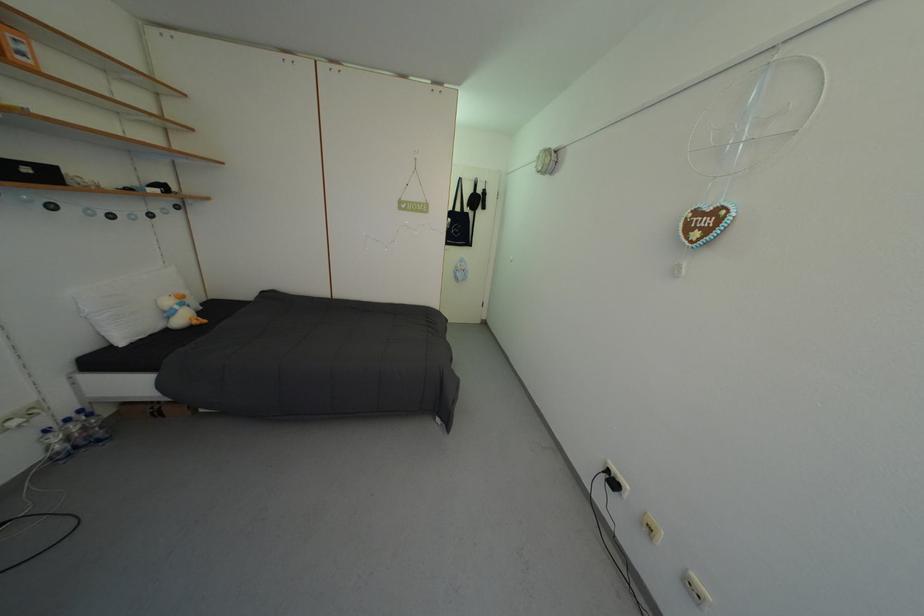
I want to click on black electrical plug, so click(612, 480).